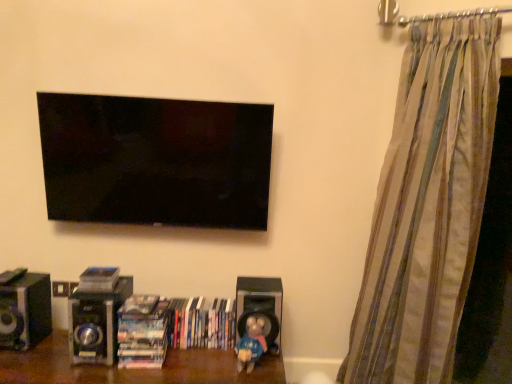
Question: Considering the relative positions of black matte speaker at lower center, which is the 1th speaker in right-to-left order, and matte plastic book at lower center, which is the 1th book in left-to-right order, in the image provided, is black matte speaker at lower center, which is the 1th speaker in right-to-left order, to the left or to the right of matte plastic book at lower center, which is the 1th book in left-to-right order,?

Choices:
 (A) left
 (B) right

Answer: (B)

Question: In terms of height, does black matte speaker at lower center, which is the 1th speaker in right-to-left order, look taller or shorter compared to matte plastic book at lower center, the third book viewed from the right?

Choices:
 (A) short
 (B) tall

Answer: (B)

Question: Which object is the closest to the wooden shelf at lower center?

Choices:
 (A) hardcover books at center, the 3th book positioned from the left
 (B) metallic silver speaker at lower left, which ranks as the second speaker in right-to-left order
 (C) black glossy speaker at lower left, the third speaker viewed from the right
 (D) hardcover books at center, acting as the 2th book starting from the left
 (E) black matte speaker at lower center, the 3th speaker when ordered from left to right

Answer: (D)

Question: Based on their relative distances, which object is nearer to the blue matte toy at lower center?

Choices:
 (A) wooden shelf at lower center
 (B) striped fabric curtain at right
 (C) matte plastic book at lower center, the third book viewed from the right
 (D) black glossy speaker at lower left, which ranks as the 1th speaker in left-to-right order
 (E) hardcover books at center, which is the first book from right to left

Answer: (E)